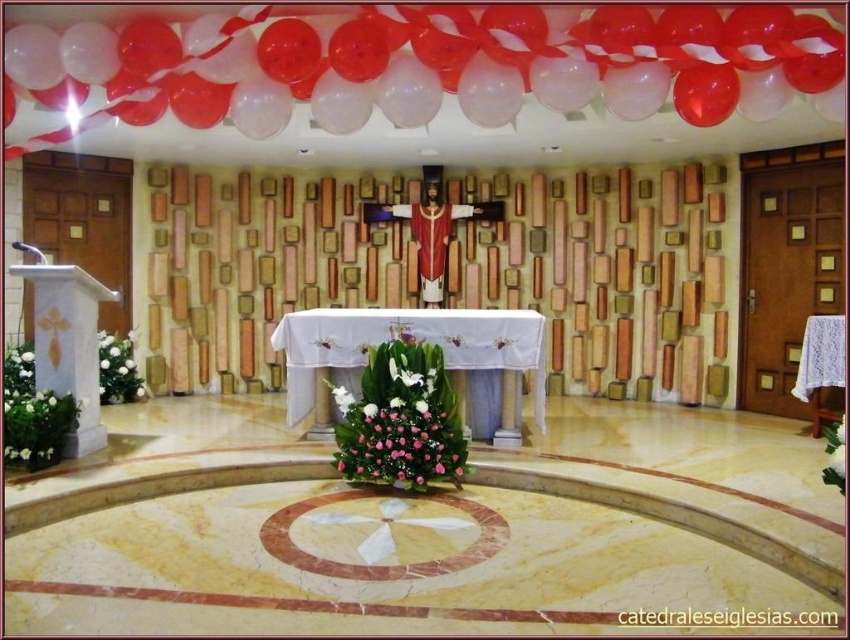
You are an event planner arranging decorations in the church. You notice the white embroidered cloth at center and the shiny red fabric crucifix at center. Which object is positioned higher in the scene?

The shiny red fabric crucifix at center is positioned higher than the white embroidered cloth at center, as it is placed above the cloth on the altar.